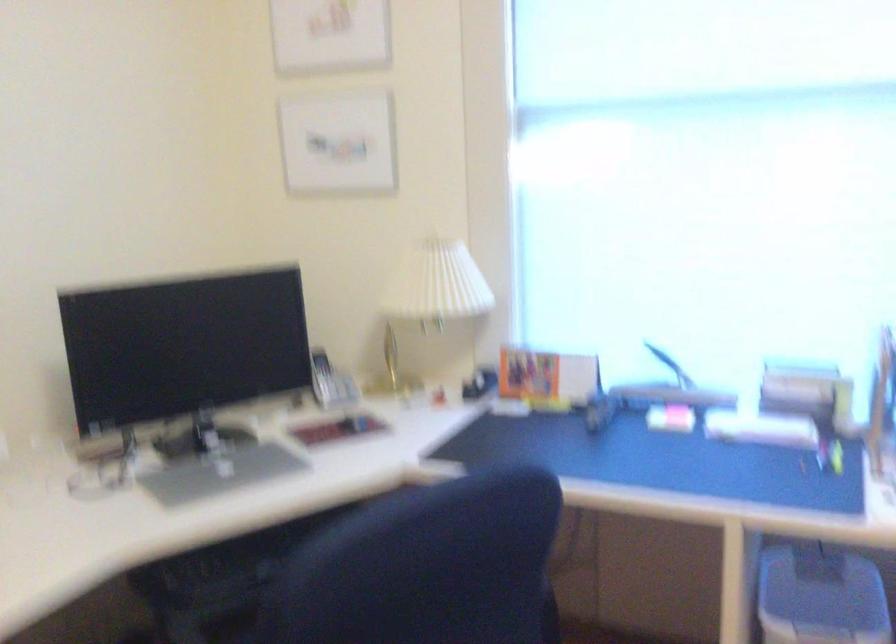
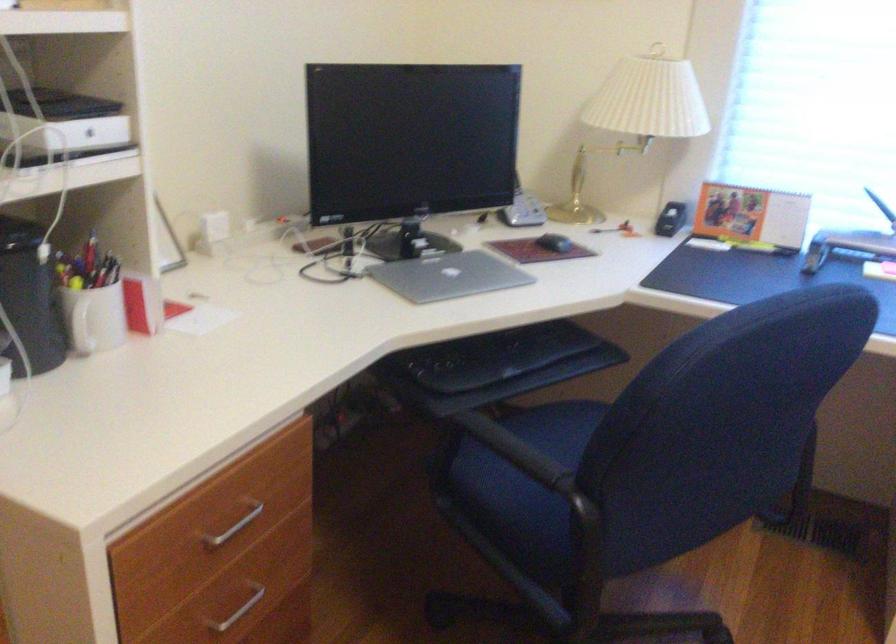
The point at (639, 400) is marked in the first image. Where is the corresponding point in the second image?

(847, 245)